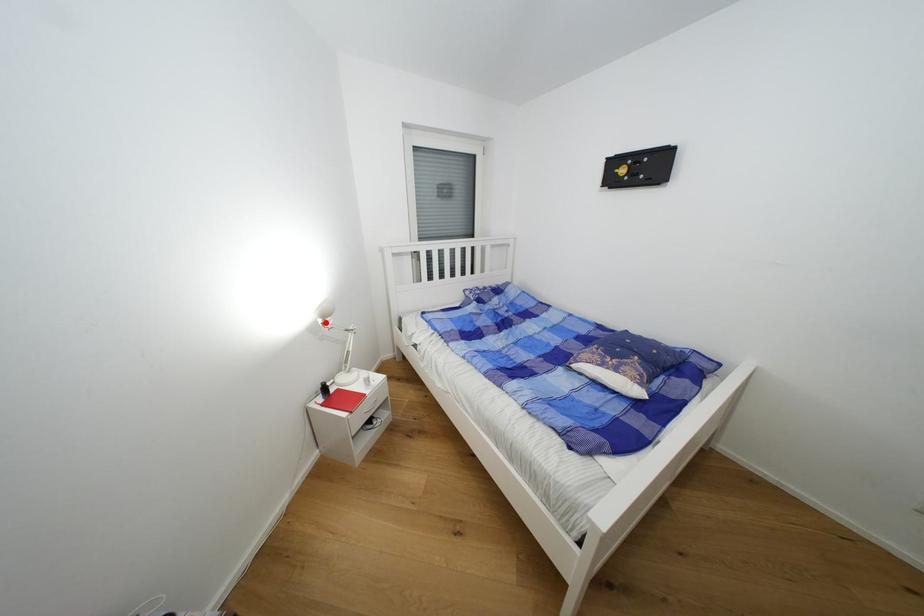
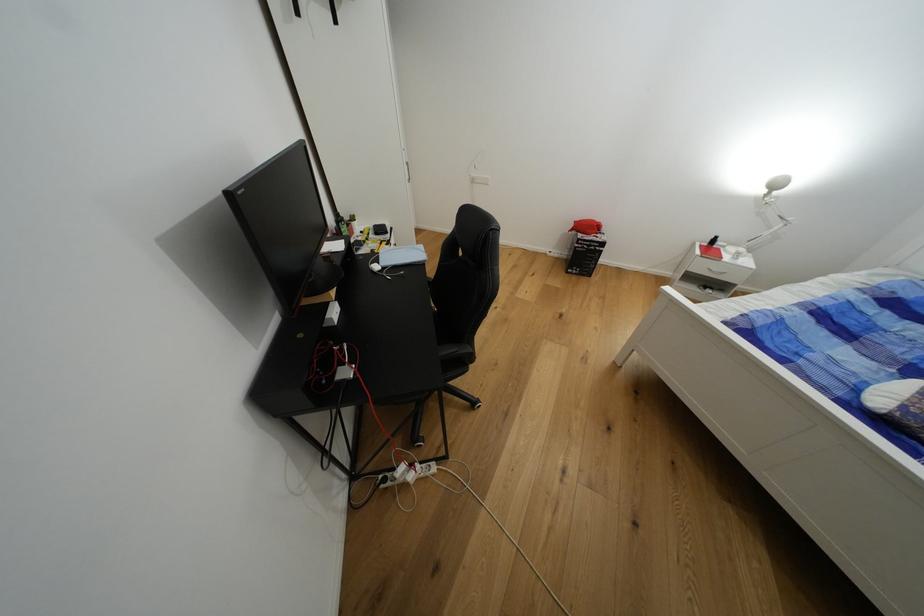
Locate, in the second image, the point that corresponds to the highlighted location in the first image.

(771, 193)